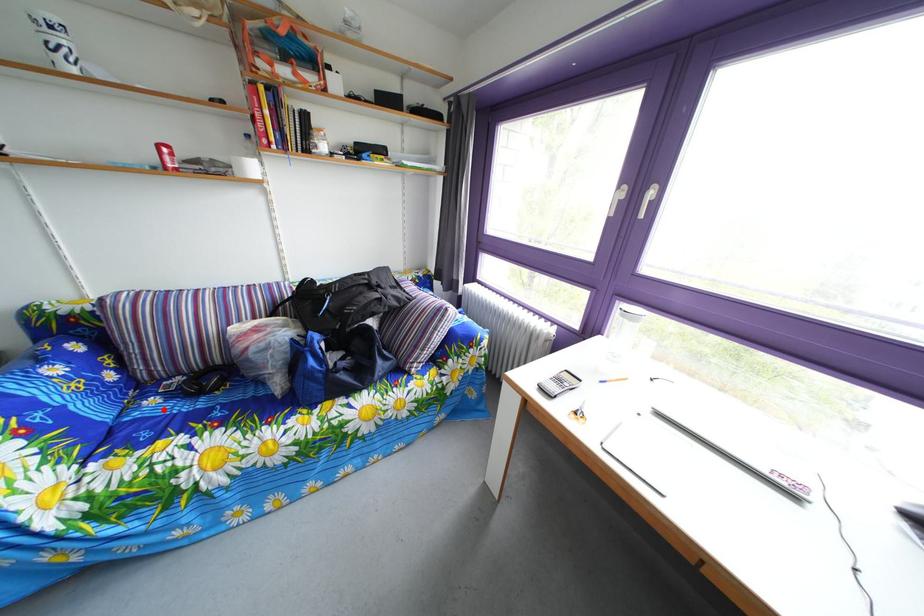
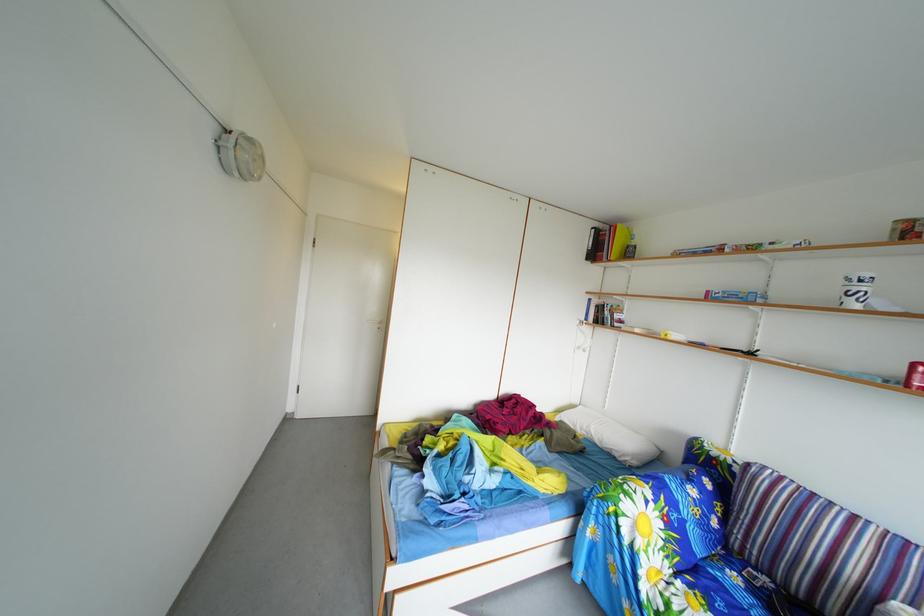
The point at the highlighted location is marked in the first image. Where is the corresponding point in the second image?

(746, 585)